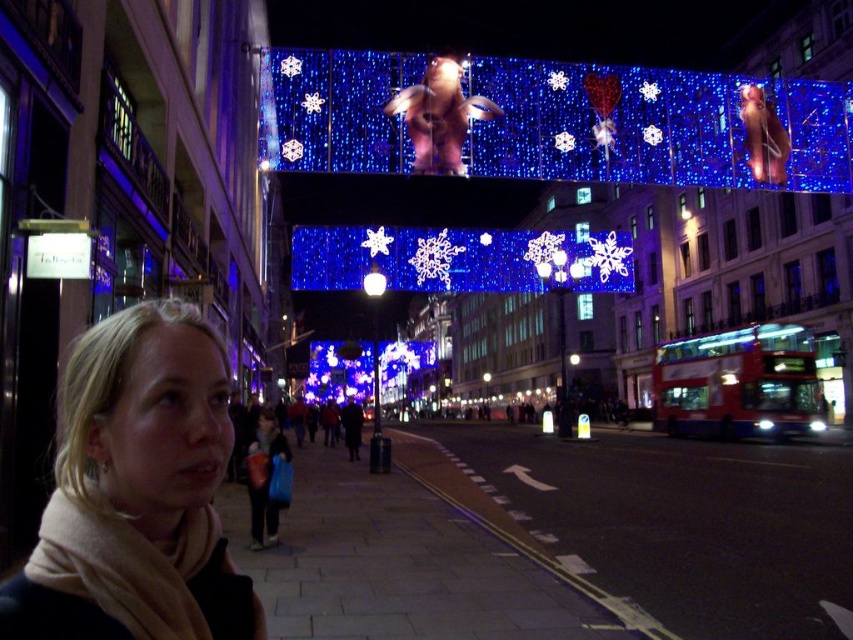
Does point (527, 92) lie behind point (6, 616)?

Yes.

Measure the distance from blue led lights at center to blonde hair at lower left.

They are 52.21 meters apart.

In order to click on blue led lights at center in this screenshot , I will do `click(561, 122)`.

Where is `blue led lights at center`? blue led lights at center is located at coordinates (561, 122).

Consider the image. Does blonde hair at lower left appear on the right side of red metallic bus at right?

In fact, blonde hair at lower left is to the left of red metallic bus at right.

Find the location of a particular element. blonde hair at lower left is located at coordinates (136, 492).

The image size is (853, 640). What are the coordinates of `blue led lights at center` in the screenshot? It's located at (561, 122).

Does point (846, 115) come farther from viewer compared to point (798, 346)?

No, it is in front of (798, 346).

The height and width of the screenshot is (640, 853). What do you see at coordinates (561, 122) in the screenshot? I see `blue led lights at center` at bounding box center [561, 122].

You are a GUI agent. You are given a task and a screenshot of the screen. Output one action in this format:
    pyautogui.click(x=<x>, y=<y>)
    Task: Click on the blue led lights at center
    This screenshot has height=640, width=853.
    Given the screenshot: What is the action you would take?
    pyautogui.click(x=561, y=122)